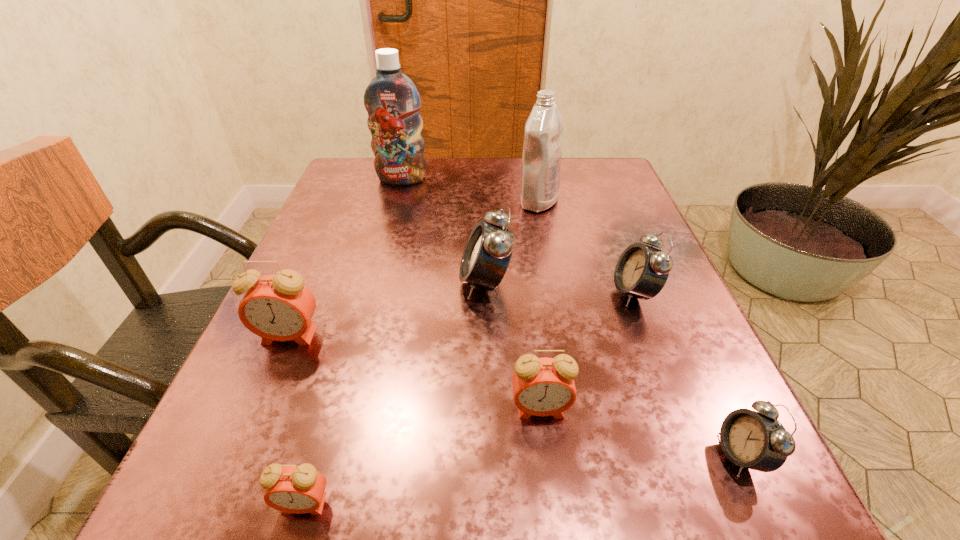
This screenshot has height=540, width=960. In order to click on the farthest object in this screenshot , I will do `click(392, 101)`.

Identify the location of shampoo. (392, 101).

In order to click on the seventh shortest object in this screenshot , I will do `click(543, 136)`.

Where is `detergent`? Image resolution: width=960 pixels, height=540 pixels. detergent is located at coordinates (543, 136).

I want to click on the leftmost white alarm clock, so click(x=488, y=252).

This screenshot has width=960, height=540. I want to click on the biggest pink alarm clock, so click(x=279, y=307).

Where is `the leftmost alarm clock`? This screenshot has width=960, height=540. the leftmost alarm clock is located at coordinates (279, 307).

Locate an element on the screen. the second smallest white alarm clock is located at coordinates (641, 271).

Find the location of `the third nearest object`. the third nearest object is located at coordinates click(x=544, y=386).

This screenshot has height=540, width=960. In order to click on the second nearest pink alarm clock in this screenshot , I will do `click(544, 386)`.